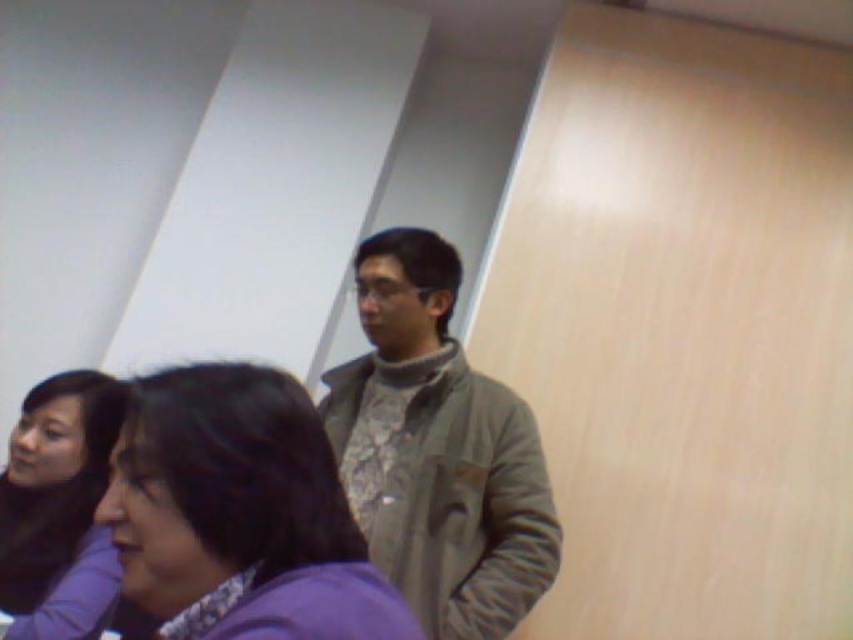
You are an interior designer assessing the layout of this room. You notice the purple fabric at center and the matte black hair at upper left. Which object is positioned to the right of the other?

The purple fabric at center is to the right of the matte black hair at upper left.

You are organizing a photoshoot and need to arrange the gray fabric jacket at center and the purple fabric at center in a way that follows the current setup. Which fabric should be placed to the right of the other?

The gray fabric jacket at center should be placed to the right of the purple fabric at center because the gray fabric jacket at center is positioned on the right side of purple fabric at center in the current setup.